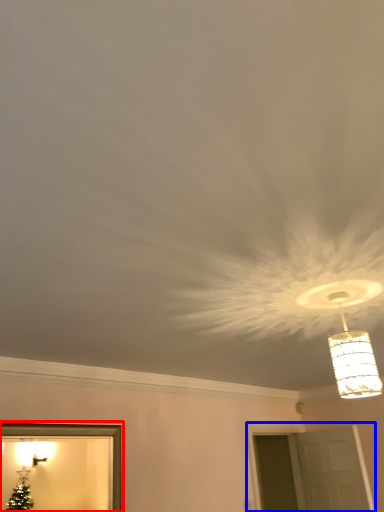
Question: Which object appears farthest to the camera in this image, picture frame (highlighted by a red box) or window (highlighted by a blue box)?

Choices:
 (A) picture frame
 (B) window

Answer: (B)